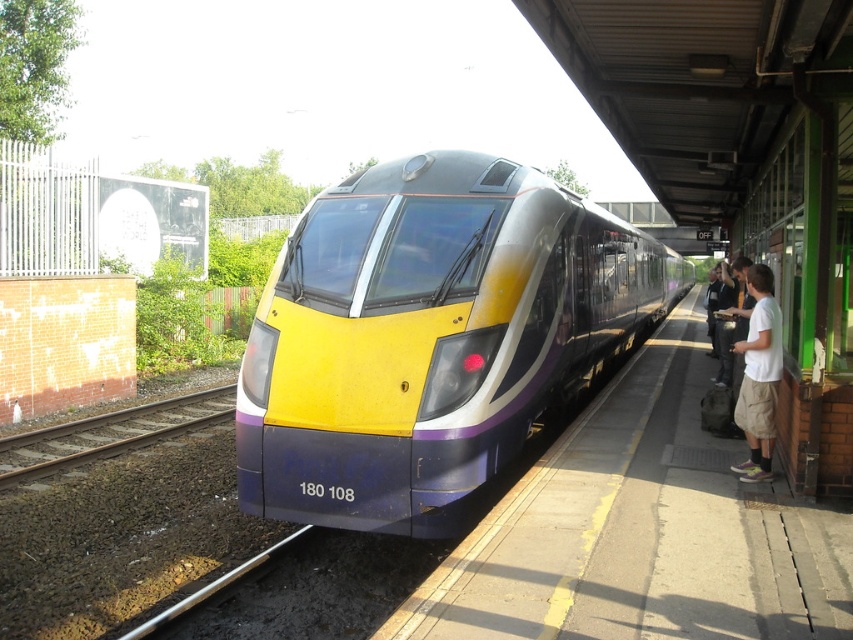
You are a passenger waiting at the station. You see the yellow matte train at center and the brown gravel train track at lower left. Which object is closer to you?

The yellow matte train at center is closer to you because it is in front of the brown gravel train track at lower left.

You are standing on the platform and want to take a photo of the yellow matte train at center. If your camera can focus on objects up to 5 meters away, will it be able to capture the train clearly?

The yellow matte train at center is 5.23 meters from the camera, which is beyond the camera focus limit of 5 meters. Therefore, the camera cannot capture the train clearly.

You are a passenger waiting at the station platform. You see the yellow matte train at center and the white cotton shirt at right. Which object is positioned further to the right?

The white cotton shirt at right is positioned further to the right than the yellow matte train at center.